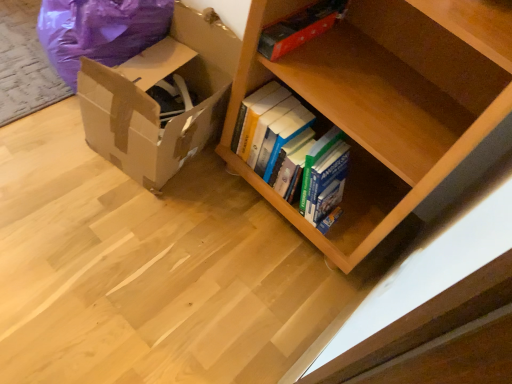
This screenshot has height=384, width=512. Find the location of `free point in front of purple plastic bean bag chair at left`. free point in front of purple plastic bean bag chair at left is located at coordinates (53, 132).